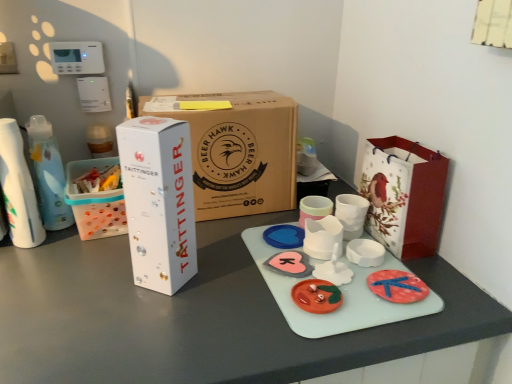
I want to click on spots to the right of matte plastic toy at center, acting as the 1th toy starting from the front, so click(x=404, y=295).